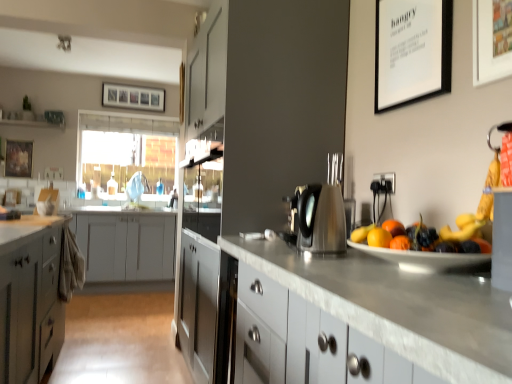
Question: Considering the relative sizes of white matte picture frame at upper right, arranged as the third picture frame when viewed from the left, and satin gray cabinet at center in the image provided, is white matte picture frame at upper right, arranged as the third picture frame when viewed from the left, wider than satin gray cabinet at center?

Choices:
 (A) no
 (B) yes

Answer: (A)

Question: Can we say white matte picture frame at upper right, which is the 2th picture frame in right-to-left order, lies outside satin gray cabinet at center?

Choices:
 (A) yes
 (B) no

Answer: (A)

Question: Is white matte picture frame at upper right, arranged as the third picture frame when viewed from the left, further to camera compared to satin gray cabinet at center?

Choices:
 (A) no
 (B) yes

Answer: (A)

Question: From a real-world perspective, is white matte picture frame at upper right, acting as the second picture frame starting from the front, over satin gray cabinet at center?

Choices:
 (A) yes
 (B) no

Answer: (A)

Question: Is the depth of white matte picture frame at upper right, acting as the second picture frame starting from the front, less than that of satin gray cabinet at center?

Choices:
 (A) yes
 (B) no

Answer: (A)

Question: Is wooden picture frame at upper center, the 4th picture frame when ordered from front to back, bigger or smaller than wooden framed artwork at upper left, the first picture frame from the left?

Choices:
 (A) small
 (B) big

Answer: (B)

Question: From the image's perspective, relative to wooden framed artwork at upper left, arranged as the 4th picture frame when viewed from the right, is wooden picture frame at upper center, the second picture frame from the left, above or below?

Choices:
 (A) above
 (B) below

Answer: (A)

Question: Is wooden picture frame at upper center, the 4th picture frame when ordered from front to back, in front of or behind wooden framed artwork at upper left, arranged as the 4th picture frame when viewed from the right, in the image?

Choices:
 (A) behind
 (B) front

Answer: (A)

Question: Considering the positions of point (132, 94) and point (27, 145), is point (132, 94) closer or farther from the camera than point (27, 145)?

Choices:
 (A) closer
 (B) farther

Answer: (B)

Question: From the image's perspective, relative to wooden picture frame at upper center, the second picture frame from the left, is white matte picture frame at upper right, which is the 2th picture frame in right-to-left order, above or below?

Choices:
 (A) below
 (B) above

Answer: (A)

Question: Does point (389, 64) appear closer or farther from the camera than point (124, 89)?

Choices:
 (A) farther
 (B) closer

Answer: (B)

Question: Is white matte picture frame at upper right, which is the 2th picture frame in right-to-left order, wider or thinner than wooden picture frame at upper center, arranged as the 1th picture frame when viewed from the back?

Choices:
 (A) thin
 (B) wide

Answer: (A)

Question: From their relative heights in the image, would you say white matte picture frame at upper right, marked as the 3th picture frame in a back-to-front arrangement, is taller or shorter than wooden picture frame at upper center, arranged as the 1th picture frame when viewed from the back?

Choices:
 (A) tall
 (B) short

Answer: (A)

Question: In terms of size, does translucent plastic window screen at upper left appear bigger or smaller than satin nickel faucet at center?

Choices:
 (A) big
 (B) small

Answer: (A)

Question: Is translucent plastic window screen at upper left taller or shorter than satin nickel faucet at center?

Choices:
 (A) short
 (B) tall

Answer: (B)